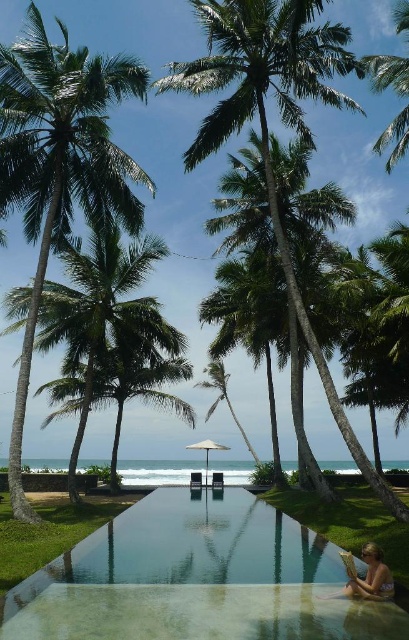
You are planning to take a photo of the two green leafy palm trees in the scene. Which palm tree, the green leafy palm tree at left or the green leafy palm tree at upper center, should you focus on if you want to capture the larger one in your shot?

The green leafy palm tree at left is bigger than the green leafy palm tree at upper center, so you should focus on the green leafy palm tree at left to capture the larger one in your photo.

You are standing at the edge of the clear glass pool at center and want to reach the green leafy palm tree at left to pick a leaf. Is the tree within easy reach from your current position?

The clear glass pool at center is located below the green leafy palm tree at left, so the tree is above the pool. Since you are at the pool edge, the tree is likely within easy reach unless there are obstacles.

You are a drone operator tasked with capturing aerial footage of the clear glass pool at center and the green leafy palm tree at upper center. The drone has a maximum flight range of 15 meters. Can the drone safely capture footage of both objects without exceeding its range?

The clear glass pool at center is 15.62 meters away from the green leafy palm tree at upper center. Since the distance between them is greater than the drone s 15 meter range, the drone cannot safely capture footage of both objects without moving its position.